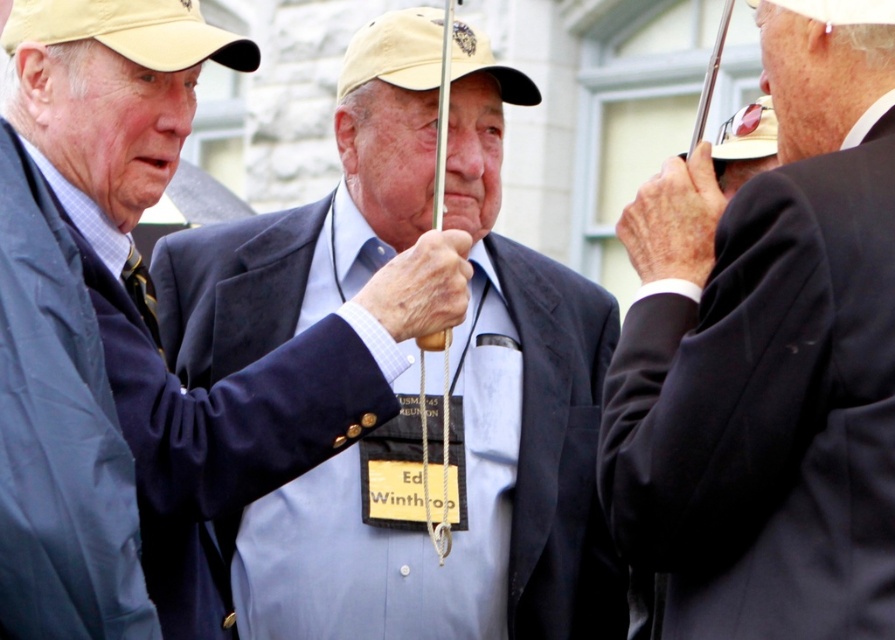
Does point (246, 428) come closer to viewer compared to point (126, 266)?

Yes, it is.

Based on the photo, is the position of matte black suit at center less distant than that of yellow striped tie at left?

Yes, matte black suit at center is in front of yellow striped tie at left.

Is point (107, 256) positioned before point (141, 307)?

Yes, point (107, 256) is closer to viewer.

Identify the location of matte black suit at center. (138, 332).

Is beige fabric baseball cap at upper left bigger than yellow striped tie at left?

Indeed, beige fabric baseball cap at upper left has a larger size compared to yellow striped tie at left.

Between point (197, 36) and point (139, 262), which one is positioned in front?

Point (197, 36) is in front.

Between point (109, 19) and point (134, 292), which one is positioned behind?

Point (134, 292)

Where is `beige fabric baseball cap at upper left`? The image size is (895, 640). beige fabric baseball cap at upper left is located at coordinates (131, 32).

Does matte black suit at center lie in front of beige fabric baseball cap at upper left?

Yes.

Is point (192, 56) in front of point (64, 36)?

No, (192, 56) is further to viewer.

Describe the element at coordinates (138, 332) in the screenshot. I see `matte black suit at center` at that location.

I want to click on matte black suit at center, so click(x=138, y=332).